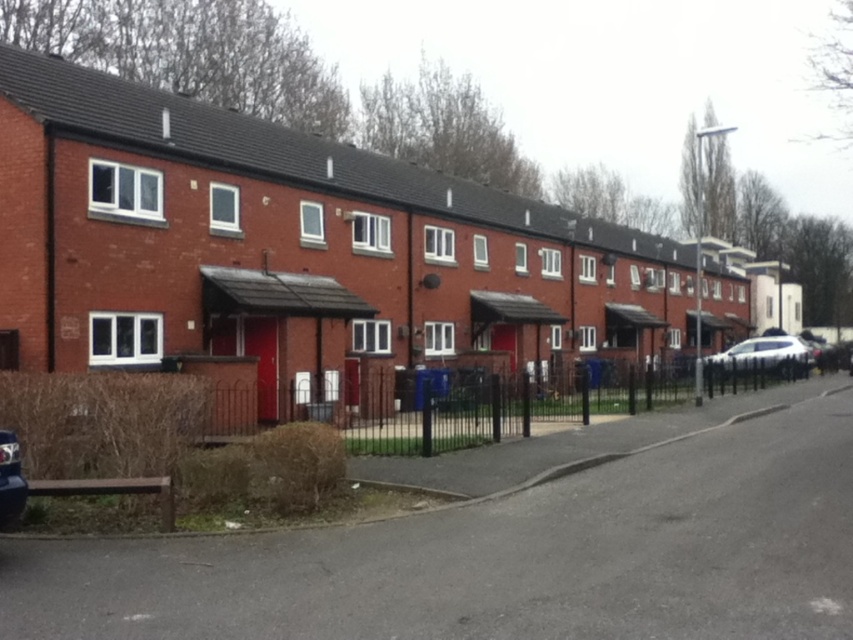
You are a delivery person needing to park your van between the white glossy sedan at right and the metallic silver car at lower left. Can your van fit in the space between them?

The white glossy sedan at right is larger than the metallic silver car at lower left, but the exact distance between them isn not specified. Without knowing the space between them, it is impossible to determine if the van can fit.